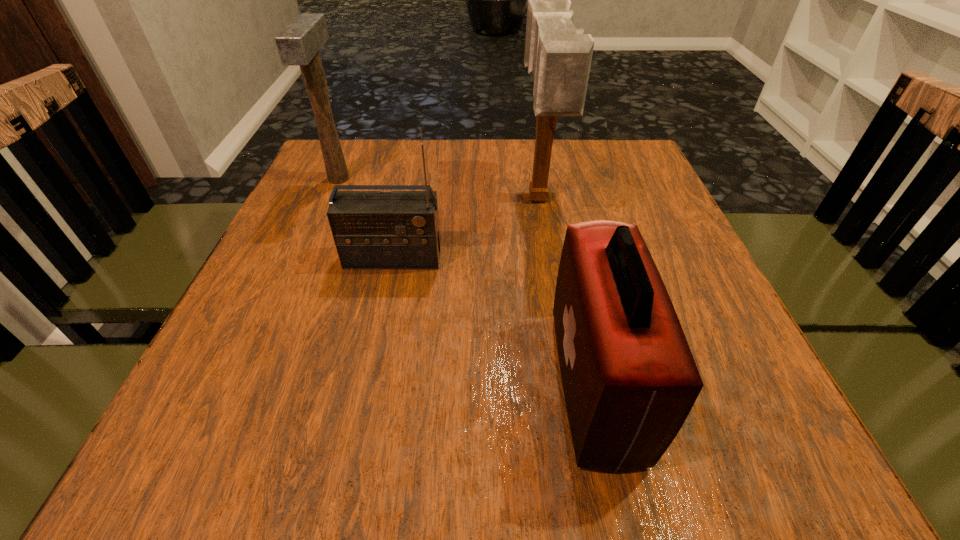
You are a GUI agent. You are given a task and a screenshot of the screen. Output one action in this format:
    pyautogui.click(x=<x>, y=<y>)
    Task: Click on the right mallet
    The image size is (960, 540).
    Given the screenshot: What is the action you would take?
    pyautogui.click(x=559, y=56)

Identify the location of the left mallet. The image size is (960, 540). (299, 43).

At what (x,y) coordinates should I click in order to perform the action: click on the second object from left to right. Please return your answer as a coordinate pair (x, y). Looking at the image, I should click on (371, 229).

You are a GUI agent. You are given a task and a screenshot of the screen. Output one action in this format:
    pyautogui.click(x=<x>, y=<y>)
    Task: Click on the radio receiver
    
    Given the screenshot: What is the action you would take?
    pyautogui.click(x=371, y=229)

The height and width of the screenshot is (540, 960). Find the location of `the first aid kit`. the first aid kit is located at coordinates (629, 378).

Find the location of `free space located 0.190m on the front of the right mallet`. free space located 0.190m on the front of the right mallet is located at coordinates (556, 308).

Find the location of a particular element. This screenshot has width=960, height=540. vacant space located 0.100m on the right of the leftmost object is located at coordinates (390, 179).

Image resolution: width=960 pixels, height=540 pixels. Identify the location of free region located 0.060m on the front panel of the radio receiver. (386, 293).

The image size is (960, 540). Identify the location of vacant region located on the side of the first aid kit with the cross symbol. (353, 384).

The image size is (960, 540). Identify the location of vacant area situated on the side of the first aid kit with the cross symbol. (367, 384).